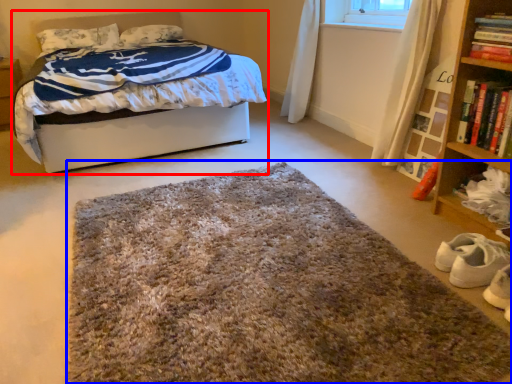
Question: Which point is further to the camera, bed (highlighted by a red box) or mat (highlighted by a blue box)?

Choices:
 (A) bed
 (B) mat

Answer: (A)